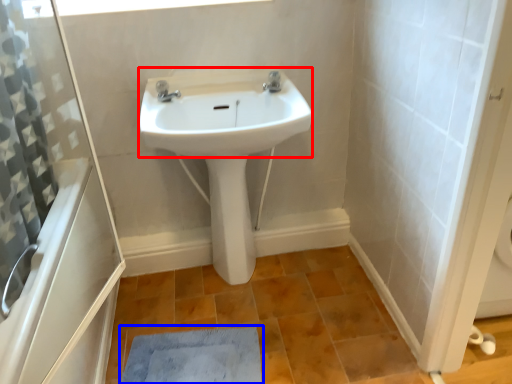
Question: Which object is closer to the camera taking this photo, sink (highlighted by a red box) or doormat (highlighted by a blue box)?

Choices:
 (A) sink
 (B) doormat

Answer: (A)